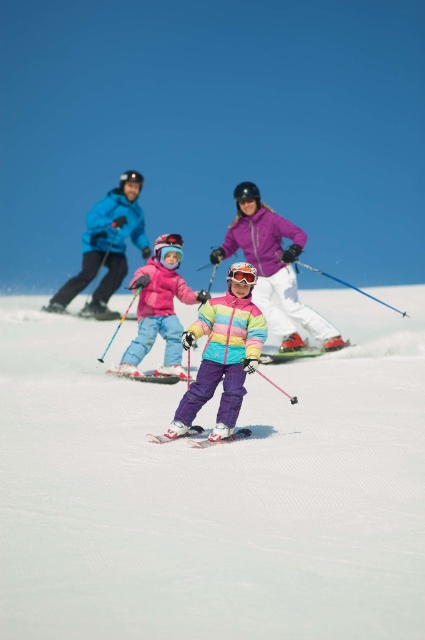
Who is higher up, rainbow fabric ski suit at center or metallic silver ski at center?

Positioned higher is rainbow fabric ski suit at center.

Can you confirm if rainbow fabric ski suit at center is wider than metallic silver ski at center?

In fact, rainbow fabric ski suit at center might be narrower than metallic silver ski at center.

Is point (189, 419) behind point (142, 372)?

No, (189, 419) is in front of (142, 372).

Image resolution: width=425 pixels, height=640 pixels. Identify the location of rainbow fabric ski suit at center. (221, 358).

Which is in front, point (271, 356) or point (255, 282)?

Positioned in front is point (255, 282).

Who is positioned more to the right, green matte ski at center or translucent orange goggles at center?

From the viewer's perspective, green matte ski at center appears more on the right side.

This screenshot has width=425, height=640. In order to click on green matte ski at center in this screenshot , I will do `click(297, 353)`.

Which is above, rainbow fabric ski suit at center or matte black ski at center?

matte black ski at center is above.

Who is positioned more to the right, rainbow fabric ski suit at center or matte black ski at center?

From the viewer's perspective, rainbow fabric ski suit at center appears more on the right side.

Who is more forward, (235, 401) or (59, 310)?

Point (235, 401) is in front.

The image size is (425, 640). I want to click on rainbow fabric ski suit at center, so click(x=221, y=358).